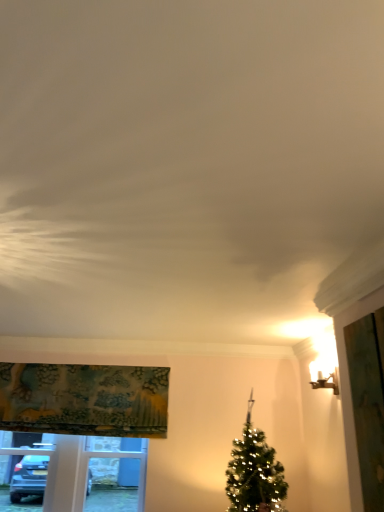
Question: Is green fabric screen door at right beside textured fabric curtain at upper left?

Choices:
 (A) yes
 (B) no

Answer: (B)

Question: From a real-world perspective, does green fabric screen door at right stand above textured fabric curtain at upper left?

Choices:
 (A) yes
 (B) no

Answer: (B)

Question: Does green fabric screen door at right turn towards textured fabric curtain at upper left?

Choices:
 (A) yes
 (B) no

Answer: (B)

Question: From the image's perspective, is green fabric screen door at right located beneath textured fabric curtain at upper left?

Choices:
 (A) no
 (B) yes

Answer: (A)

Question: Considering the relative sizes of green fabric screen door at right and textured fabric curtain at upper left in the image provided, is green fabric screen door at right shorter than textured fabric curtain at upper left?

Choices:
 (A) yes
 (B) no

Answer: (B)

Question: Is point (314, 380) closer or farther from the camera than point (28, 448)?

Choices:
 (A) farther
 (B) closer

Answer: (B)

Question: Is matte gold sconce at upper right in front of or behind white plastic window frame at lower left in the image?

Choices:
 (A) behind
 (B) front

Answer: (B)

Question: Considering the positions of matte gold sconce at upper right and white plastic window frame at lower left in the image, is matte gold sconce at upper right taller or shorter than white plastic window frame at lower left?

Choices:
 (A) tall
 (B) short

Answer: (B)

Question: Looking at the image, does matte gold sconce at upper right seem bigger or smaller compared to white plastic window frame at lower left?

Choices:
 (A) small
 (B) big

Answer: (A)

Question: In the image, is white plastic window frame at lower left positioned in front of or behind green fabric screen door at right?

Choices:
 (A) behind
 (B) front

Answer: (A)

Question: Is white plastic window frame at lower left taller or shorter than green fabric screen door at right?

Choices:
 (A) short
 (B) tall

Answer: (A)

Question: Does point (137, 487) appear closer or farther from the camera than point (365, 321)?

Choices:
 (A) closer
 (B) farther

Answer: (B)

Question: From the image's perspective, relative to green fabric screen door at right, is white plastic window frame at lower left above or below?

Choices:
 (A) below
 (B) above

Answer: (A)

Question: Is green fabric screen door at right in front of or behind white plastic window frame at lower left in the image?

Choices:
 (A) behind
 (B) front

Answer: (B)

Question: From the image's perspective, is green fabric screen door at right above or below white plastic window frame at lower left?

Choices:
 (A) above
 (B) below

Answer: (A)